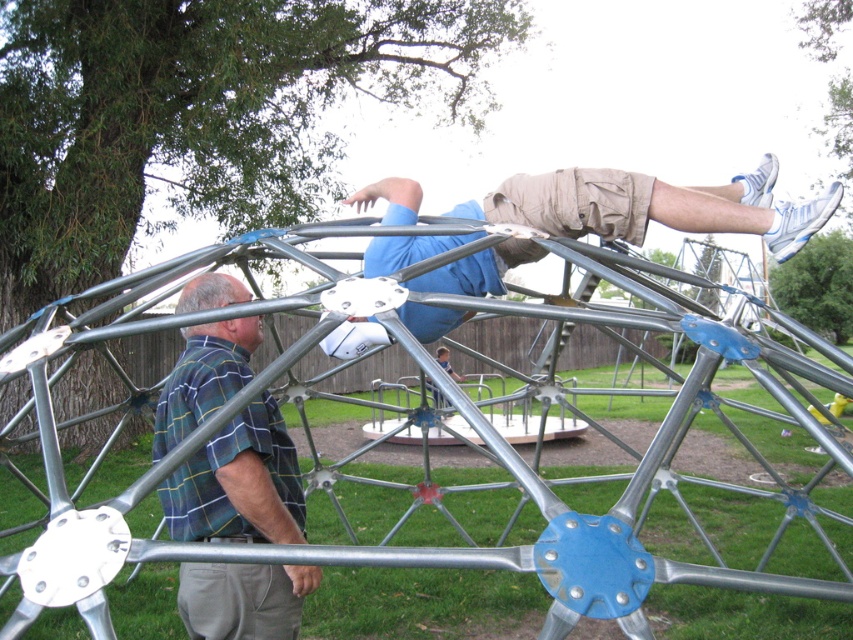
You are a child trying to climb up the dome structure. There is a green plaid shirt at left and a light brown fabric shorts at upper center in your view. Which direction should you move to reach the top of the dome?

You should move toward the light brown fabric shorts at upper center because it is positioned higher up on the dome structure compared to the green plaid shirt at left, which is located below it.